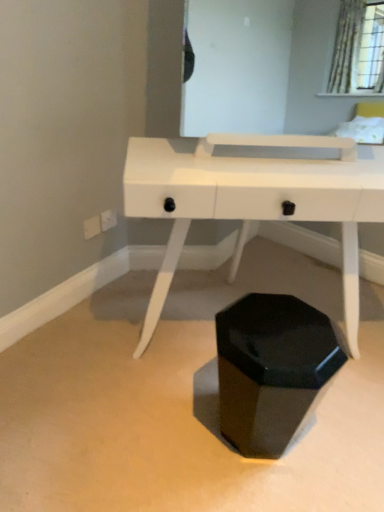
Image resolution: width=384 pixels, height=512 pixels. I want to click on free location in front of black glossy hexagonal at center, so click(261, 493).